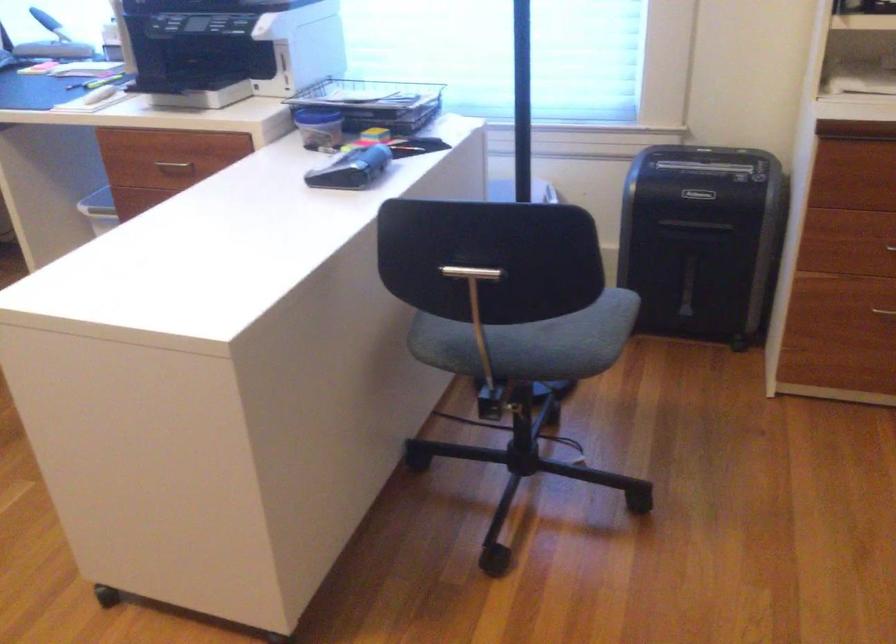
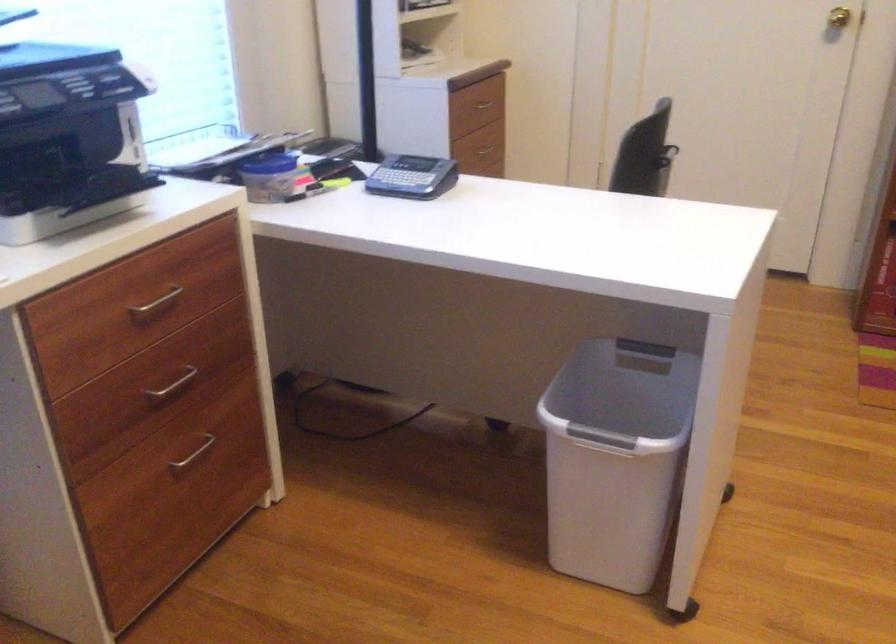
Find the pixel in the second image that matches (300,453) in the first image.

(625, 389)